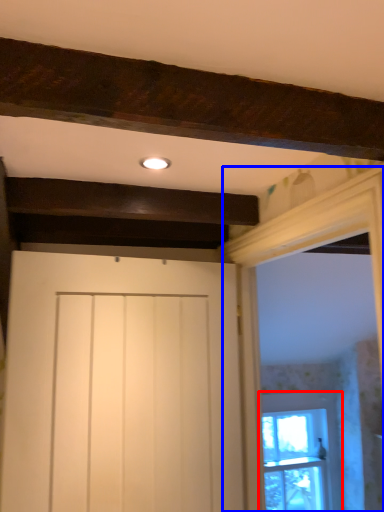
Question: Which object appears farthest to the camera in this image, window (highlighted by a red box) or window frame (highlighted by a blue box)?

Choices:
 (A) window
 (B) window frame

Answer: (A)